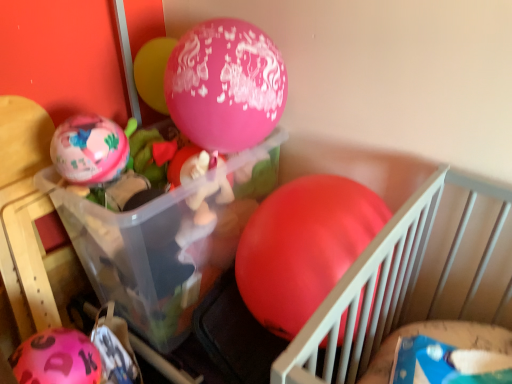
Question: Is pink matte balloon at lower left, the 1th balloon positioned from the left, in front of or behind pink glossy balloon at upper center, marked as the third balloon in a left-to-right arrangement, in the image?

Choices:
 (A) behind
 (B) front

Answer: (B)

Question: Is pink matte balloon at lower left, the 1th balloon positioned from the left, wider or thinner than pink glossy balloon at upper center, marked as the third balloon in a left-to-right arrangement?

Choices:
 (A) thin
 (B) wide

Answer: (B)

Question: Which object is positioned farthest from the matte pink balloon at left, which is the third balloon from right to left?

Choices:
 (A) rubber matte balloon at center, which is the first balloon in right-to-left order
 (B) pink matte balloon at lower left, the 1th balloon positioned from the left
 (C) transparent plastic container at center
 (D) pink glossy balloon at upper center, marked as the third balloon in a left-to-right arrangement

Answer: (A)

Question: Which object is the farthest from the matte pink balloon at left, which is the third balloon from right to left?

Choices:
 (A) pink matte balloon at lower left, the fourth balloon from the right
 (B) rubber matte balloon at center, which is the first balloon in right-to-left order
 (C) transparent plastic container at center
 (D) pink glossy balloon at upper center, marked as the third balloon in a left-to-right arrangement

Answer: (B)